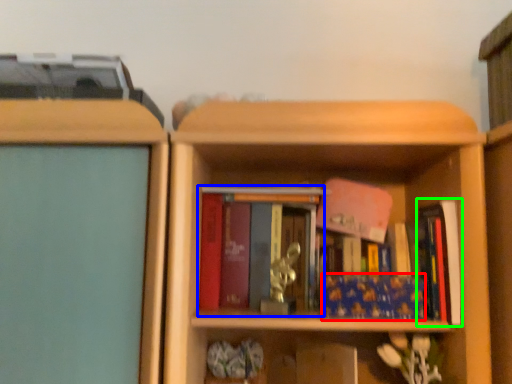
Question: Which object is the closest to the book (highlighted by a red box)? Choose among these: book (highlighted by a blue box) or book (highlighted by a green box).

Choices:
 (A) book
 (B) book

Answer: (B)